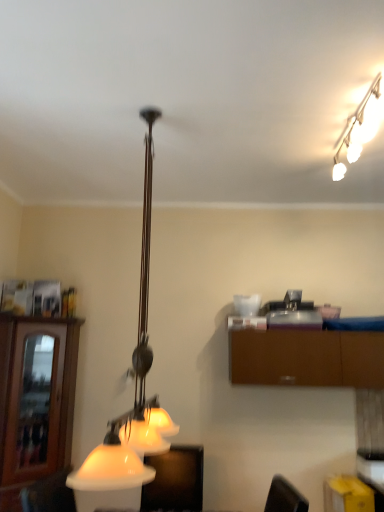
Question: Is matte white lampshade at lower center in front of brown wood cabinet at left, which is counted as the 1th cabinetry, starting from the left?

Choices:
 (A) yes
 (B) no

Answer: (A)

Question: Does matte white lampshade at lower center have a lesser height compared to brown wood cabinet at left, which appears as the 2th cabinetry when viewed from the right?

Choices:
 (A) yes
 (B) no

Answer: (A)

Question: Is matte white lampshade at lower center to the left of brown wood cabinet at left, which appears as the 2th cabinetry when viewed from the right, from the viewer's perspective?

Choices:
 (A) no
 (B) yes

Answer: (A)

Question: From a real-world perspective, is matte white lampshade at lower center positioned over brown wood cabinet at left, which is counted as the 1th cabinetry, starting from the left, based on gravity?

Choices:
 (A) no
 (B) yes

Answer: (A)

Question: Is matte white lampshade at lower center outside of brown wood cabinet at left, which appears as the 2th cabinetry when viewed from the right?

Choices:
 (A) no
 (B) yes

Answer: (B)

Question: In terms of width, does brown wood cabinet at left, which is counted as the 1th cabinetry, starting from the left, look wider or thinner when compared to brown matte cabinet at upper right, acting as the second cabinetry starting from the left?

Choices:
 (A) thin
 (B) wide

Answer: (A)

Question: Is brown wood cabinet at left, which is counted as the 1th cabinetry, starting from the left, inside or outside of brown matte cabinet at upper right, acting as the second cabinetry starting from the left?

Choices:
 (A) outside
 (B) inside

Answer: (A)

Question: Is point (69, 374) positioned closer to the camera than point (319, 376)?

Choices:
 (A) farther
 (B) closer

Answer: (A)

Question: Considering the positions of brown wood cabinet at left, which is counted as the 1th cabinetry, starting from the left, and brown matte cabinet at upper right, acting as the second cabinetry starting from the left, in the image, is brown wood cabinet at left, which is counted as the 1th cabinetry, starting from the left, taller or shorter than brown matte cabinet at upper right, acting as the second cabinetry starting from the left,?

Choices:
 (A) tall
 (B) short

Answer: (A)

Question: From the image's perspective, relative to white glossy lamp at center, the 2th lamp in the right-to-left sequence, is matte white lampshade at lower center above or below?

Choices:
 (A) above
 (B) below

Answer: (B)

Question: Is matte white lampshade at lower center to the left or to the right of white glossy lamp at center, which ranks as the first lamp in left-to-right order, in the image?

Choices:
 (A) right
 (B) left

Answer: (A)

Question: In terms of height, does matte white lampshade at lower center look taller or shorter compared to white glossy lamp at center, the 2th lamp in the right-to-left sequence?

Choices:
 (A) short
 (B) tall

Answer: (A)

Question: From a real-world perspective, is matte white lampshade at lower center positioned above or below white glossy lamp at center, which ranks as the first lamp in left-to-right order?

Choices:
 (A) above
 (B) below

Answer: (B)

Question: Considering the positions of brown wood cabinet at left, which is counted as the 1th cabinetry, starting from the left, and matte white lampshade at lower center in the image, is brown wood cabinet at left, which is counted as the 1th cabinetry, starting from the left, wider or thinner than matte white lampshade at lower center?

Choices:
 (A) thin
 (B) wide

Answer: (A)

Question: Does point (57, 435) appear closer or farther from the camera than point (170, 501)?

Choices:
 (A) closer
 (B) farther

Answer: (B)